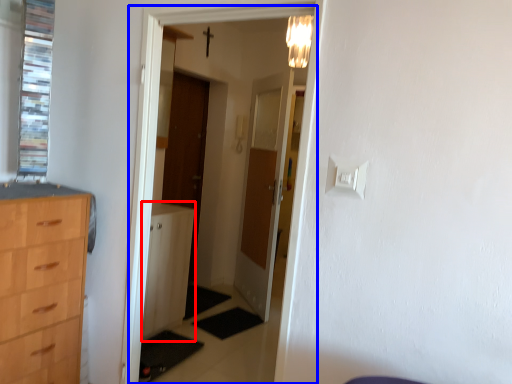
Question: Among these objects, which one is farthest to the camera, file cabinet (highlighted by a red box) or corridor (highlighted by a blue box)?

Choices:
 (A) file cabinet
 (B) corridor

Answer: (A)